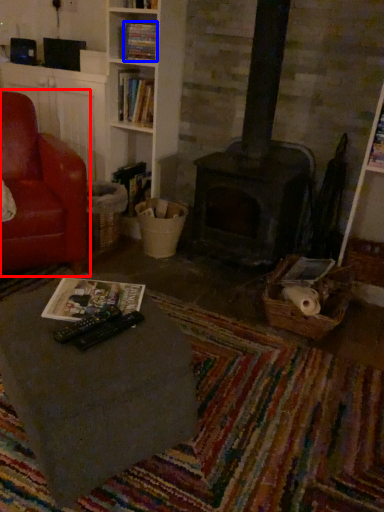
Question: Among these objects, which one is nearest to the camera, chair (highlighted by a red box) or book (highlighted by a blue box)?

Choices:
 (A) chair
 (B) book

Answer: (A)